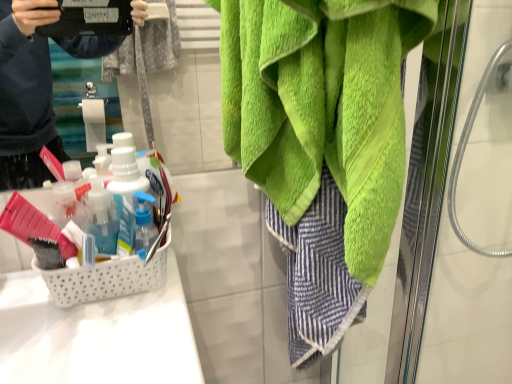
Where is `green terry cloth towel at right`? Image resolution: width=512 pixels, height=384 pixels. green terry cloth towel at right is located at coordinates (322, 106).

The height and width of the screenshot is (384, 512). What do you see at coordinates (322, 106) in the screenshot?
I see `green terry cloth towel at right` at bounding box center [322, 106].

Identify the location of green terry cloth towel at right. The image size is (512, 384). (322, 106).